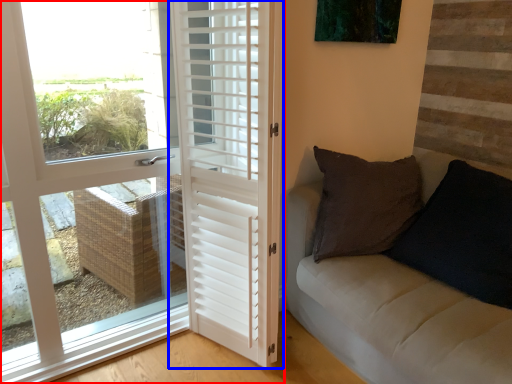
Question: Among these objects, which one is nearest to the camera, door (highlighted by a red box) or door (highlighted by a blue box)?

Choices:
 (A) door
 (B) door

Answer: (A)